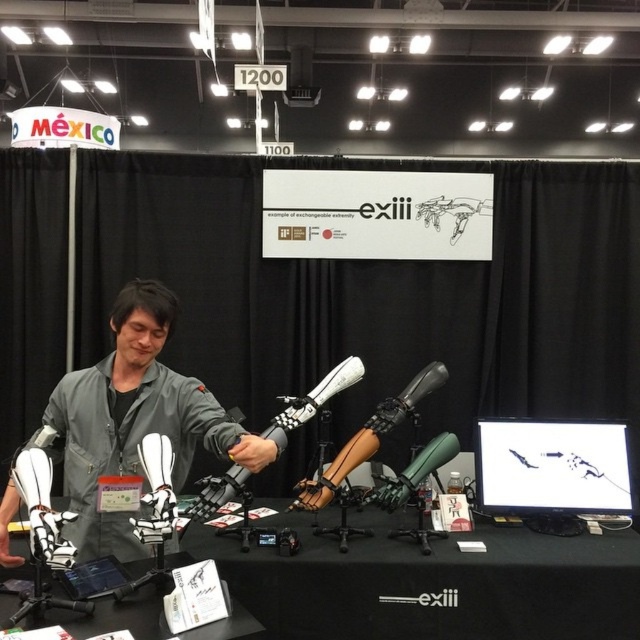
Between point (460, 618) and point (164, 404), which one is positioned behind?

Positioned behind is point (460, 618).

Is point (611, 625) in front of point (150, 285)?

No, (611, 625) is behind (150, 285).

This screenshot has height=640, width=640. Identify the location of black matte table at center. (436, 586).

Can you confirm if black matte table at center is positioned to the left of green matte microphone at center?

No, black matte table at center is not to the left of green matte microphone at center.

Who is more distant from viewer, (x=518, y=609) or (x=433, y=440)?

Point (x=433, y=440)

This screenshot has width=640, height=640. I want to click on black matte table at center, so click(436, 586).

Can you confirm if black matte microphone at center is positioned to the right of yellow matte hand at center?

Yes, black matte microphone at center is to the right of yellow matte hand at center.

Can you confirm if black matte microphone at center is positioned below yellow matte hand at center?

No, black matte microphone at center is not below yellow matte hand at center.

This screenshot has width=640, height=640. Describe the element at coordinates (406, 397) in the screenshot. I see `black matte microphone at center` at that location.

Image resolution: width=640 pixels, height=640 pixels. I want to click on black matte microphone at center, so click(406, 397).